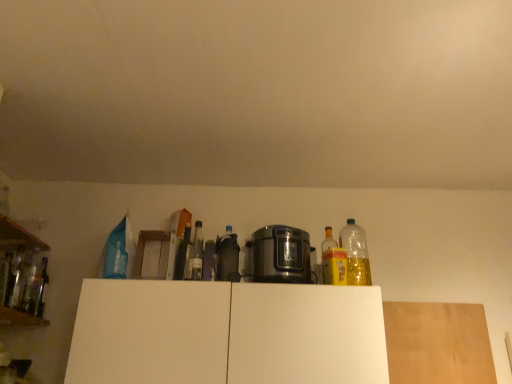
Question: Is white matte cabinet at center next to wooden at left, placed as the 1th shelf when sorted from top to bottom, and touching it?

Choices:
 (A) no
 (B) yes

Answer: (A)

Question: Does white matte cabinet at center have a larger size compared to wooden at left, which is counted as the second shelf, starting from the bottom?

Choices:
 (A) yes
 (B) no

Answer: (A)

Question: Is white matte cabinet at center outside of wooden at left, placed as the 1th shelf when sorted from top to bottom?

Choices:
 (A) yes
 (B) no

Answer: (A)

Question: Would you consider white matte cabinet at center to be distant from wooden at left, which is counted as the second shelf, starting from the bottom?

Choices:
 (A) no
 (B) yes

Answer: (B)

Question: Is wooden at left, placed as the 1th shelf when sorted from top to bottom, surrounded by white matte cabinet at center?

Choices:
 (A) yes
 (B) no

Answer: (B)

Question: Considering the positions of wooden at left, the 2th shelf positioned from the top, and clear glass bottle at left, the second bottle from the left, in the image, is wooden at left, the 2th shelf positioned from the top, taller or shorter than clear glass bottle at left, the second bottle from the left,?

Choices:
 (A) short
 (B) tall

Answer: (A)

Question: From a real-world perspective, is wooden at left, the 1th shelf when ordered from bottom to top, above or below clear glass bottle at left, the 7th bottle in the right-to-left sequence?

Choices:
 (A) below
 (B) above

Answer: (A)

Question: Which is correct: wooden at left, the 2th shelf positioned from the top, is inside clear glass bottle at left, the 7th bottle in the right-to-left sequence, or outside of it?

Choices:
 (A) inside
 (B) outside

Answer: (B)

Question: Considering their positions, is wooden at left, the 2th shelf positioned from the top, located in front of or behind clear glass bottle at left, the second bottle from the left?

Choices:
 (A) behind
 (B) front

Answer: (B)

Question: In terms of height, does green glass bottle at center, which ranks as the fifth bottle in right-to-left order, look taller or shorter compared to clear glass bottle at left, the 7th bottle in the right-to-left sequence?

Choices:
 (A) short
 (B) tall

Answer: (B)

Question: In the image, is green glass bottle at center, which ranks as the fifth bottle in right-to-left order, positioned in front of or behind clear glass bottle at left, the second bottle from the left?

Choices:
 (A) behind
 (B) front

Answer: (A)

Question: From the image's perspective, is green glass bottle at center, which ranks as the fifth bottle in right-to-left order, located above or below clear glass bottle at left, the 7th bottle in the right-to-left sequence?

Choices:
 (A) below
 (B) above

Answer: (B)

Question: Looking at the image, does green glass bottle at center, the 4th bottle from the left, seem bigger or smaller compared to clear glass bottle at left, the second bottle from the left?

Choices:
 (A) small
 (B) big

Answer: (A)

Question: Would you say translucent plastic bottle at center, the third bottle when ordered from right to left, is to the left or to the right of satin metallic rice cooker at center in the picture?

Choices:
 (A) left
 (B) right

Answer: (A)

Question: From the image's perspective, is translucent plastic bottle at center, the third bottle when ordered from right to left, located above or below satin metallic rice cooker at center?

Choices:
 (A) above
 (B) below

Answer: (A)